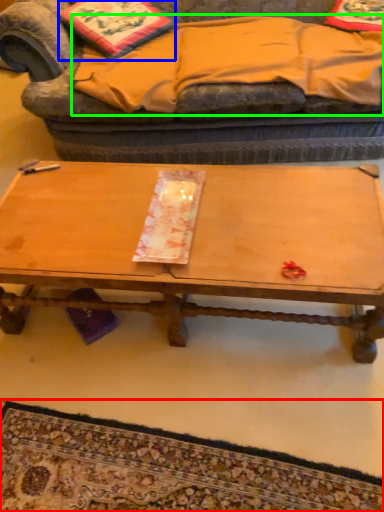
Question: Which object is positioned closest to mat (highlighted by a red box)? Select from pillow (highlighted by a blue box) and blanket (highlighted by a green box).

Choices:
 (A) pillow
 (B) blanket

Answer: (B)